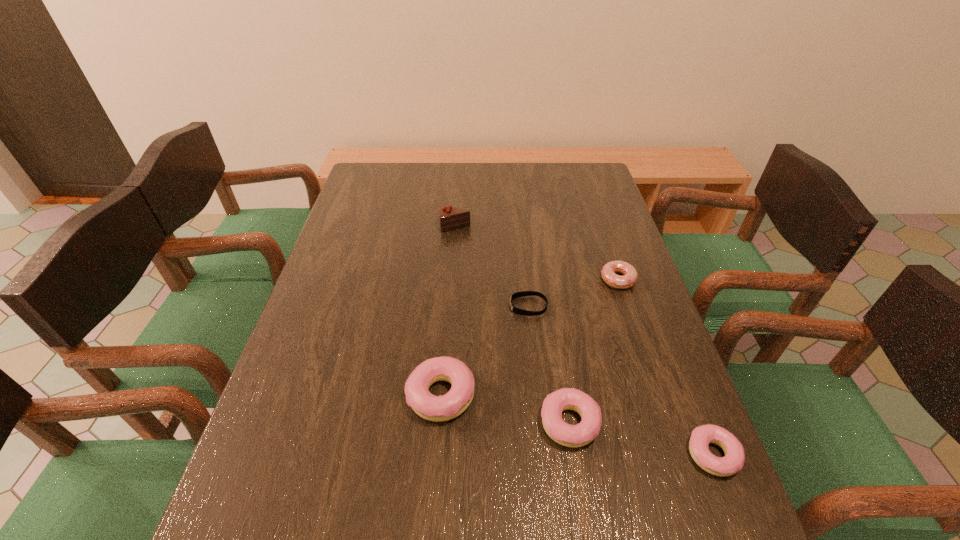
Locate an element on the screen. The height and width of the screenshot is (540, 960). free space between the second doughnut from left to right and the farthest doughnut is located at coordinates (593, 352).

Locate which object is the closest to the fourth nearest object. Please provide its 2D coordinates. Your answer should be formatted as a tuple, i.e. [(x, y)], where the tuple contains the x and y coordinates of a point satisfying the conditions above.

[(608, 271)]

Identify which object is located as the fifth nearest to the shortest object. Please provide its 2D coordinates. Your answer should be formatted as a tuple, i.e. [(x, y)], where the tuple contains the x and y coordinates of a point satisfying the conditions above.

[(701, 436)]

Locate which doughnut ranks in proximity to the third doughnut from right to left. Please provide its 2D coordinates. Your answer should be formatted as a tuple, i.e. [(x, y)], where the tuple contains the x and y coordinates of a point satisfying the conditions above.

[(445, 407)]

Find the location of `doughnut identified as the closest to the second tallest doughnut`. doughnut identified as the closest to the second tallest doughnut is located at coordinates (445, 407).

Locate an element on the screen. vacant position in the image that satisfies the following two spatial constraints: 1. on the front side of the third shortest doughnut; 2. on the right side of the second tallest object is located at coordinates (439, 423).

I want to click on vacant point that satisfies the following two spatial constraints: 1. on the back side of the second doughnut from left to right; 2. on the right side of the farthest doughnut, so click(x=546, y=280).

Find the location of `free space in the image that satisfies the following two spatial constraints: 1. on the front side of the fourth shortest object; 2. on the right side of the tallest object`. free space in the image that satisfies the following two spatial constraints: 1. on the front side of the fourth shortest object; 2. on the right side of the tallest object is located at coordinates (442, 423).